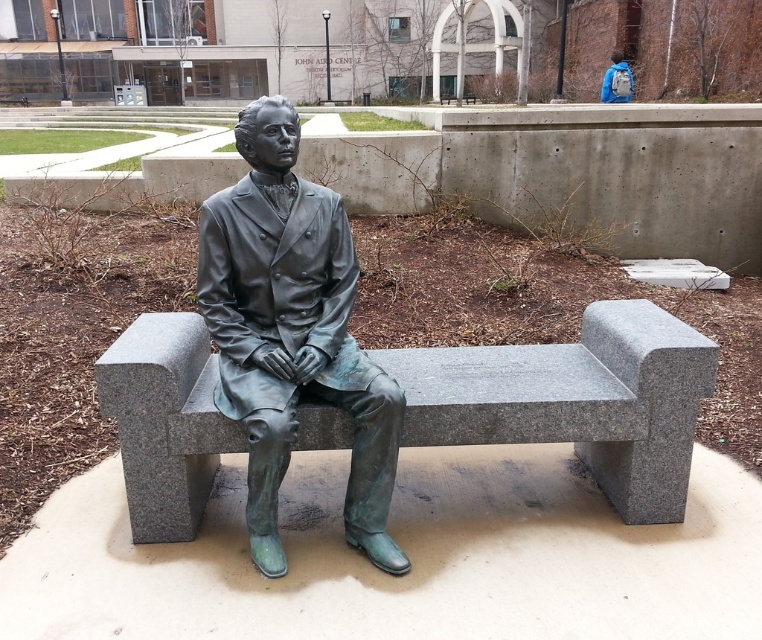
Question: Can you confirm if granite bench at center is wider than bronze statue at center?

Choices:
 (A) yes
 (B) no

Answer: (A)

Question: From the image, what is the correct spatial relationship of granite bench at center in relation to bronze statue at center?

Choices:
 (A) above
 (B) below

Answer: (B)

Question: Does granite bench at center have a larger size compared to bronze statue at center?

Choices:
 (A) no
 (B) yes

Answer: (B)